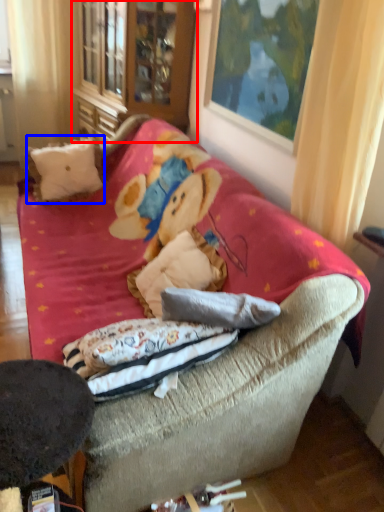
Question: Which of the following is the closest to the observer, armoire (highlighted by a red box) or throw pillow (highlighted by a blue box)?

Choices:
 (A) armoire
 (B) throw pillow

Answer: (B)